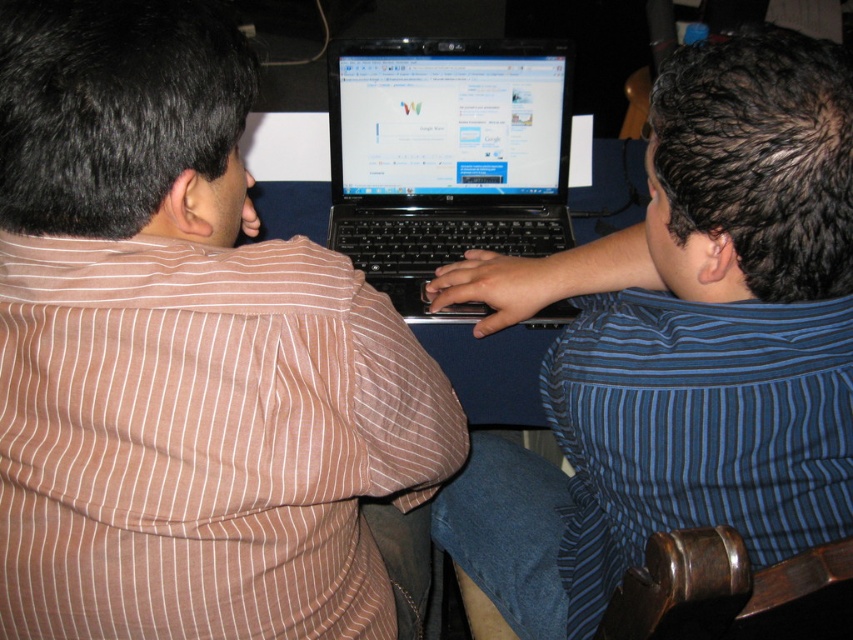
Please describe the position of the point relative to the blue striped shirt at center in terms of direction and distance. The answer should be in the format of the point is located at the direction and distance from the blue striped shirt at center. Use the coordinate system where the origin is the bottom left corner of the image, the x axis points to the right, and the y axis points upward. The distance should be in pixels. The coordinates of the blue striped shirt at center are at point (680, 346). The

The point is located at the same coordinates as the blue striped shirt at center, so it is exactly at the position of the blue striped shirt at center.

You are a tailor who needs to determine which shirt requires more fabric to make between the brown striped shirt at left and the blue striped shirt at center. Which one would you choose?

The blue striped shirt at center requires more fabric because it is larger in size compared to the brown striped shirt at left.